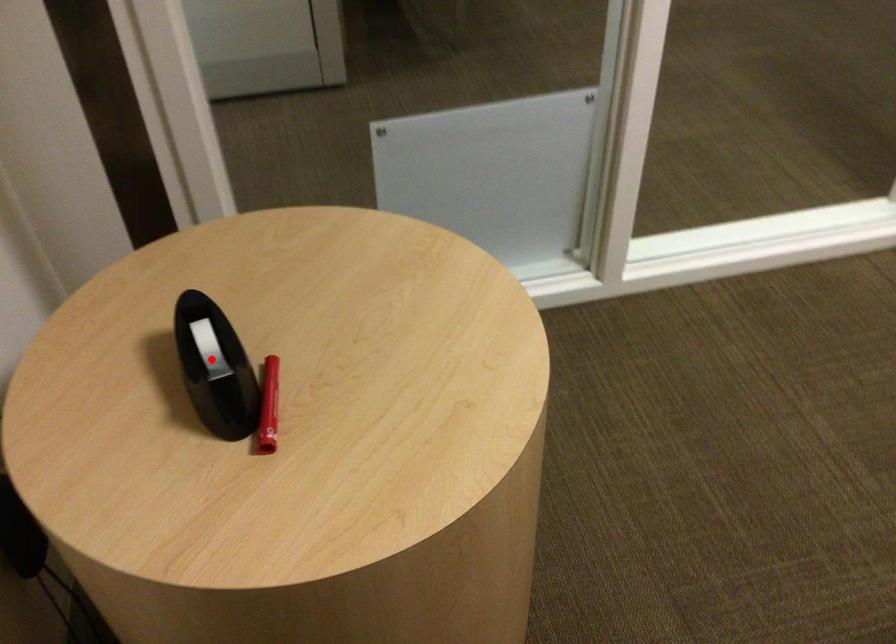
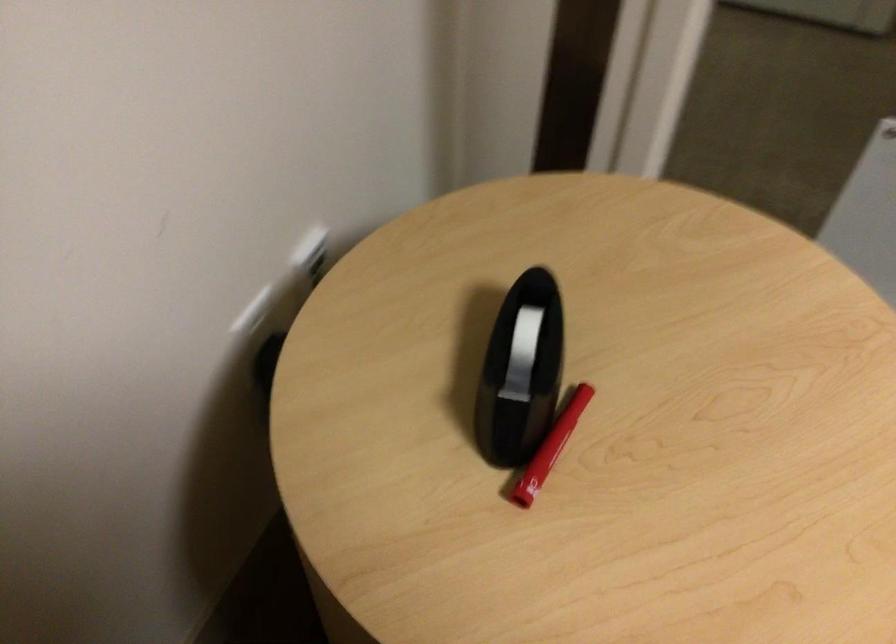
Question: I am providing you with two images of the same scene from different viewpoints. In image1, a red point is highlighted. Considering the same 3D point in image2, which of the following is correct?

Choices:
 (A) It is closer
 (B) It is farther

Answer: (A)